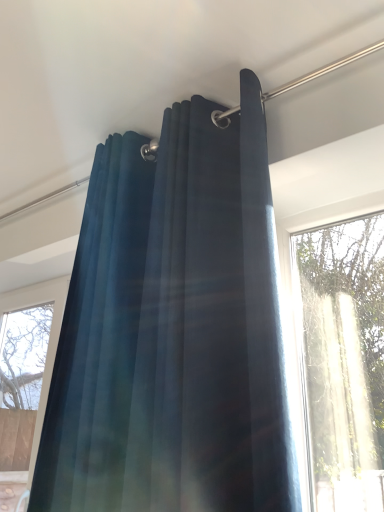
Question: Is velvet dark blue curtain at upper center smaller than velvet dark blue curtain at left?

Choices:
 (A) yes
 (B) no

Answer: (B)

Question: Does velvet dark blue curtain at upper center appear on the left side of velvet dark blue curtain at left?

Choices:
 (A) yes
 (B) no

Answer: (B)

Question: Are velvet dark blue curtain at upper center and velvet dark blue curtain at left beside each other?

Choices:
 (A) no
 (B) yes

Answer: (B)

Question: Would you say velvet dark blue curtain at upper center is a long distance from velvet dark blue curtain at left?

Choices:
 (A) no
 (B) yes

Answer: (A)

Question: Is the position of velvet dark blue curtain at upper center less distant than that of velvet dark blue curtain at left?

Choices:
 (A) yes
 (B) no

Answer: (A)

Question: From the image's perspective, is velvet dark blue curtain at upper center on top of velvet dark blue curtain at left?

Choices:
 (A) yes
 (B) no

Answer: (A)

Question: Does velvet dark blue curtain at left have a greater height compared to velvet dark blue curtain at upper center?

Choices:
 (A) no
 (B) yes

Answer: (B)

Question: Is there a large distance between velvet dark blue curtain at left and velvet dark blue curtain at upper center?

Choices:
 (A) yes
 (B) no

Answer: (B)

Question: Is velvet dark blue curtain at left positioned beyond the bounds of velvet dark blue curtain at upper center?

Choices:
 (A) no
 (B) yes

Answer: (B)

Question: From the image's perspective, would you say velvet dark blue curtain at left is shown under velvet dark blue curtain at upper center?

Choices:
 (A) no
 (B) yes

Answer: (B)

Question: Is velvet dark blue curtain at left in contact with velvet dark blue curtain at upper center?

Choices:
 (A) yes
 (B) no

Answer: (A)

Question: From the image's perspective, is velvet dark blue curtain at left over velvet dark blue curtain at upper center?

Choices:
 (A) no
 (B) yes

Answer: (A)

Question: In the image, is velvet dark blue curtain at left positioned in front of or behind velvet dark blue curtain at upper center?

Choices:
 (A) behind
 (B) front

Answer: (A)